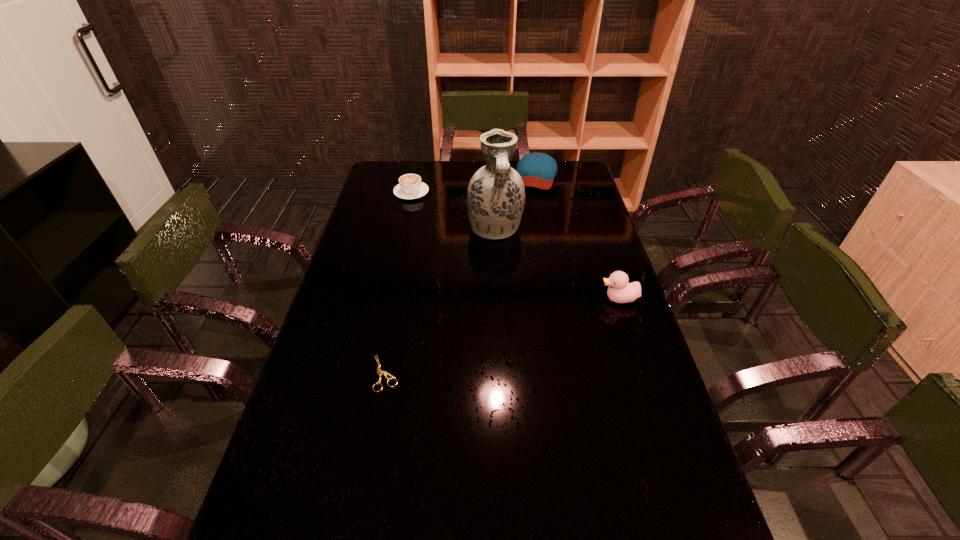
You are a GUI agent. You are given a task and a screenshot of the screen. Output one action in this format:
    pyautogui.click(x=<x>, y=<y>)
    Task: Click on the free space located on the side of the cappuccino with the handle
    The image size is (960, 540).
    Given the screenshot: What is the action you would take?
    pyautogui.click(x=455, y=237)

You are a GUI agent. You are given a task and a screenshot of the screen. Output one action in this format:
    pyautogui.click(x=<x>, y=<y>)
    Task: Click on the baseball cap that is at the far edge
    This screenshot has height=540, width=960.
    Given the screenshot: What is the action you would take?
    pyautogui.click(x=538, y=170)

Where is `cappuccino that is at the far edge`? The image size is (960, 540). cappuccino that is at the far edge is located at coordinates [410, 186].

Find the location of `object positioned at the left edge`. object positioned at the left edge is located at coordinates (410, 186).

This screenshot has height=540, width=960. Identify the location of duckling situated at the right edge. (620, 291).

At what (x,y) coordinates should I click in order to perform the action: click on baseball cap that is at the right edge. Please return your answer as a coordinate pair (x, y). The width and height of the screenshot is (960, 540). Looking at the image, I should click on (538, 170).

The width and height of the screenshot is (960, 540). I want to click on object positioned at the far left corner, so click(410, 186).

I want to click on object that is positioned at the far right corner, so click(538, 170).

In the image, there is a desktop. Identify the location of vacant space at the left edge. (375, 262).

The height and width of the screenshot is (540, 960). Find the location of `vacant space at the right edge of the desktop`. vacant space at the right edge of the desktop is located at coordinates (608, 419).